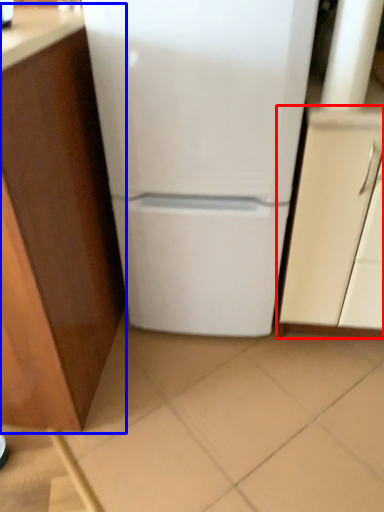
Question: Among these objects, which one is farthest to the camera, cabinetry (highlighted by a red box) or cabinetry (highlighted by a blue box)?

Choices:
 (A) cabinetry
 (B) cabinetry

Answer: (A)